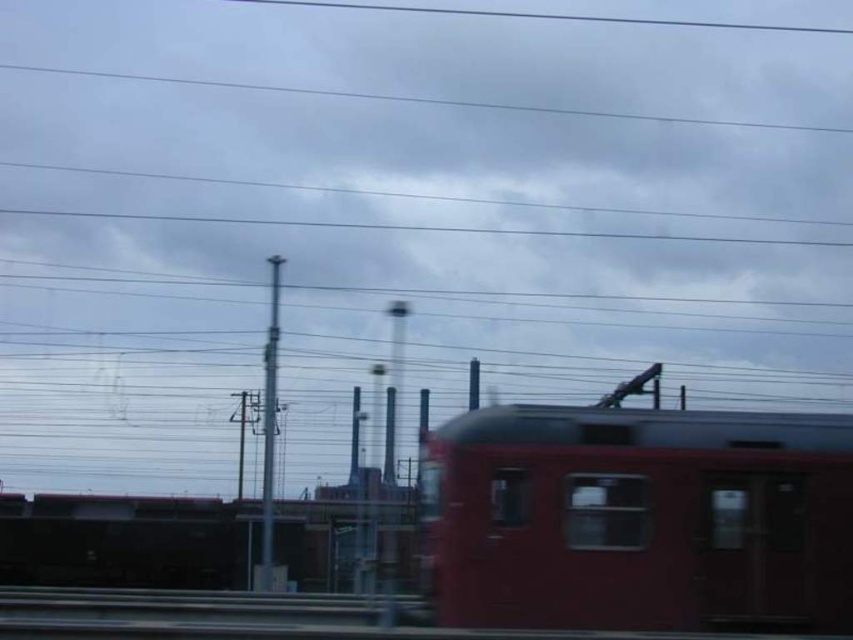
Question: Is matte red train car at center above smooth wire at upper center?

Choices:
 (A) no
 (B) yes

Answer: (A)

Question: Among these points, which one is farthest from the camera?

Choices:
 (A) (268, 3)
 (B) (582, 115)
 (C) (483, 547)
 (D) (265, 513)

Answer: (A)

Question: Is metallic wire at upper center bigger than smooth wire at upper center?

Choices:
 (A) no
 (B) yes

Answer: (B)

Question: Does metallic wire at upper center have a larger size compared to silver metallic pole at center?

Choices:
 (A) no
 (B) yes

Answer: (A)

Question: Which point is closer to the camera taking this photo?

Choices:
 (A) (387, 8)
 (B) (498, 538)
 (C) (306, 90)
 (D) (265, 436)

Answer: (B)

Question: Estimate the real-world distances between objects in this image. Which object is farther from the metallic wire at upper center?

Choices:
 (A) smooth wire at upper center
 (B) matte red train car at center
 (C) silver metallic pole at center

Answer: (B)